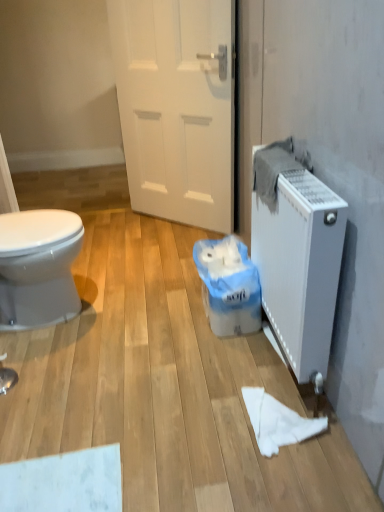
Locate an element on the screen. The image size is (384, 512). free space to the left of white paper towel at lower center is located at coordinates (214, 423).